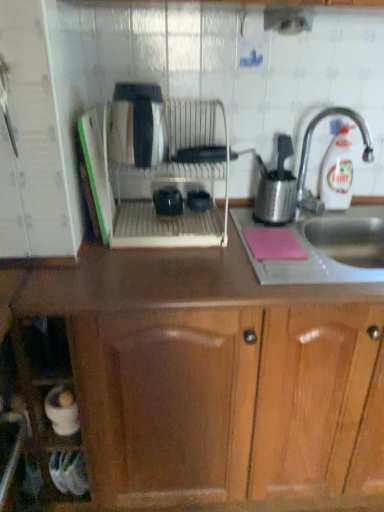
Question: Considering the positions of wooden cabinet at center and metallic sink at right in the image, is wooden cabinet at center bigger or smaller than metallic sink at right?

Choices:
 (A) small
 (B) big

Answer: (B)

Question: From a real-world perspective, is wooden cabinet at center above or below metallic sink at right?

Choices:
 (A) above
 (B) below

Answer: (B)

Question: Based on their relative distances, which object is farther from the white plastic bottle at upper right?

Choices:
 (A) metallic sink at right
 (B) silver metallic tap at right
 (C) pink matte notepad at lower right
 (D) matte black mugs at center, which is the first appliance in left-to-right order
 (E) stainless steel utensil holder at right

Answer: (D)

Question: Which object is the closest to the silver metallic tap at right?

Choices:
 (A) white plastic bottle at upper right
 (B) pink matte notepad at lower right
 (C) matte black mugs at center, which is the first appliance in left-to-right order
 (D) satin silver dish rack at center
 (E) stainless steel utensil holder at right

Answer: (A)